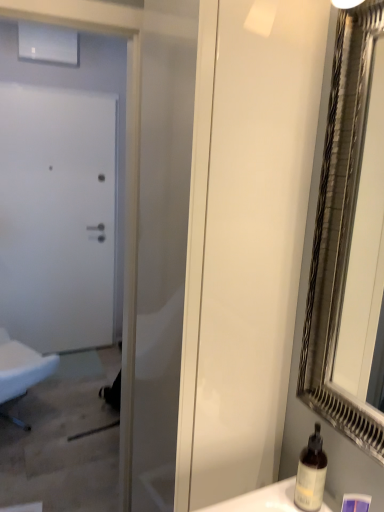
This screenshot has height=512, width=384. Identify the location of free space behind white fabric chair at left. (71, 374).